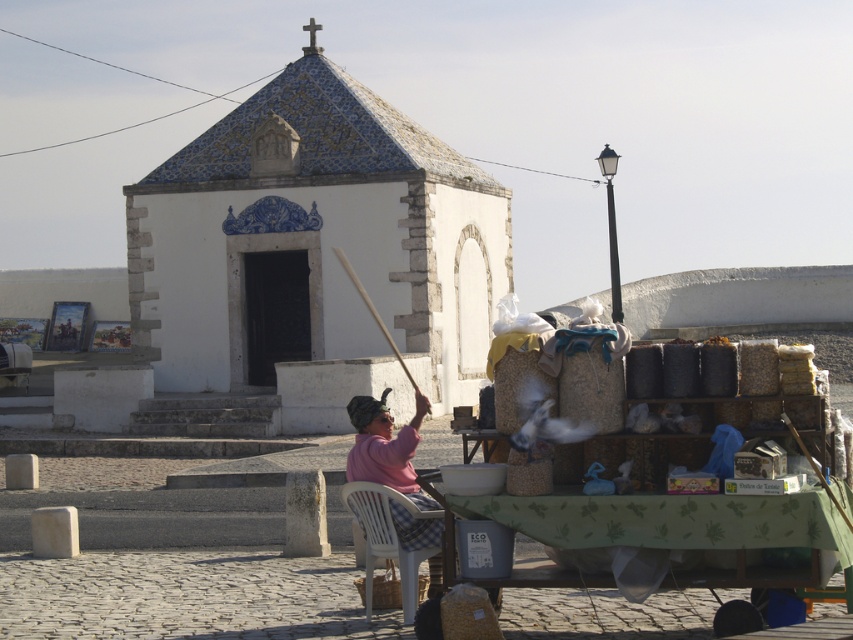
Question: Which point is closer to the camera?

Choices:
 (A) (294, 189)
 (B) (587, 532)

Answer: (B)

Question: Is blue tiled chapel at center closer to the viewer compared to pink woolen sweater at center?

Choices:
 (A) no
 (B) yes

Answer: (A)

Question: Which object is closer to the camera taking this photo?

Choices:
 (A) green fabric cart at center
 (B) blue tiled chapel at center
 (C) pink woolen sweater at center

Answer: (A)

Question: Which of the following is the closest to the observer?

Choices:
 (A) (416, 548)
 (B) (144, 320)
 (C) (418, 560)

Answer: (C)

Question: In this image, where is blue tiled chapel at center located relative to white plastic chair at lower center?

Choices:
 (A) below
 (B) above

Answer: (B)

Question: Can you confirm if blue tiled chapel at center is thinner than green fabric cart at center?

Choices:
 (A) yes
 (B) no

Answer: (B)